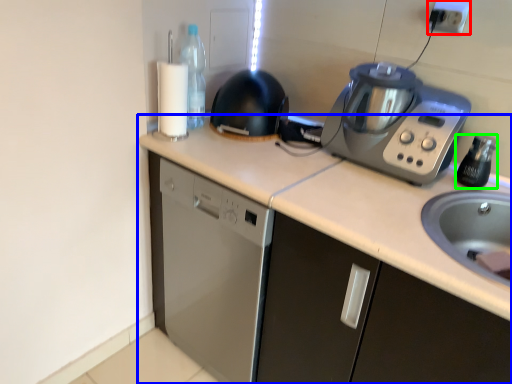
Question: Which object is the farthest from electric outlet (highlighted by a red box)? Choose among these: countertop (highlighted by a blue box) or bottle (highlighted by a green box).

Choices:
 (A) countertop
 (B) bottle

Answer: (A)